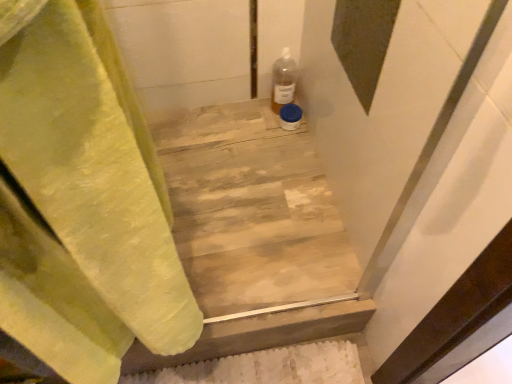
Identify the location of free space above wooden at center (from a real-world perspective). This screenshot has width=512, height=384. (238, 186).